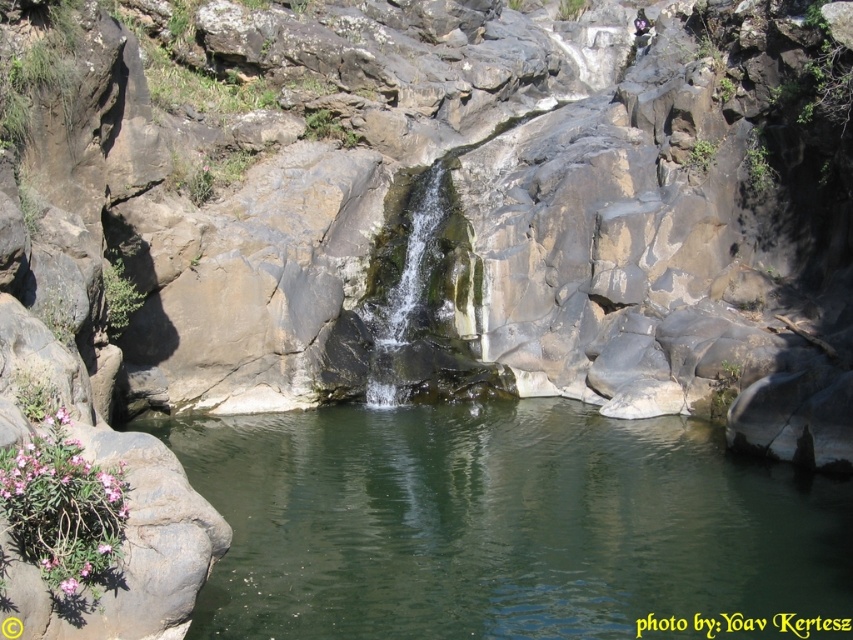
Question: Can you confirm if green smooth water at center is thinner than green mossy rock at center?

Choices:
 (A) no
 (B) yes

Answer: (A)

Question: Does green smooth water at center have a lesser width compared to green mossy rock at center?

Choices:
 (A) yes
 (B) no

Answer: (B)

Question: Does green smooth water at center appear on the right side of green mossy rock at center?

Choices:
 (A) yes
 (B) no

Answer: (A)

Question: Which object appears farthest from the camera in this image?

Choices:
 (A) green smooth water at center
 (B) green mossy rock at center

Answer: (B)

Question: Which of the following is the farthest from the observer?

Choices:
 (A) (378, 396)
 (B) (514, 429)

Answer: (A)

Question: Which point is farther to the camera?

Choices:
 (A) (408, 371)
 (B) (419, 580)

Answer: (A)